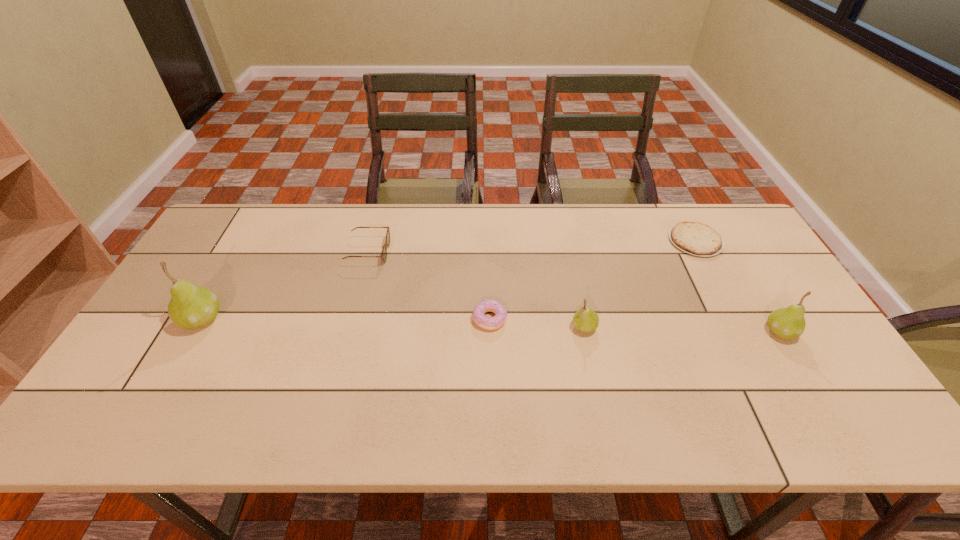
If equal spacing is desired by inserting an extra pear among them, please point out a free spot for this new pear. Please provide its 2D coordinates. Your answer should be formatted as a tuple, i.e. [(x, y)], where the tuple contains the x and y coordinates of a point satisfying the conditions above.

[(392, 323)]